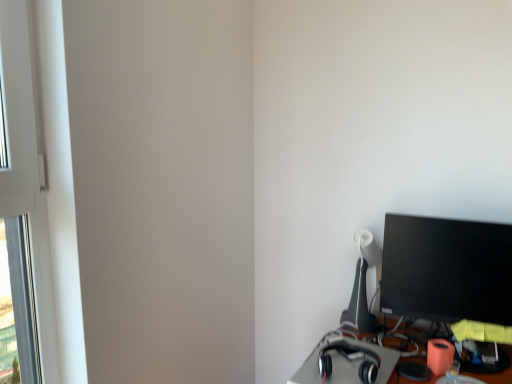
Question: From the image's perspective, is matte black table lamp at right located above satin black headphones at lower right?

Choices:
 (A) no
 (B) yes

Answer: (B)

Question: From the image's perspective, is matte black table lamp at right below satin black headphones at lower right?

Choices:
 (A) no
 (B) yes

Answer: (A)

Question: Considering the relative sizes of matte black table lamp at right and satin black headphones at lower right in the image provided, is matte black table lamp at right shorter than satin black headphones at lower right?

Choices:
 (A) no
 (B) yes

Answer: (A)

Question: Can you confirm if matte black table lamp at right is bigger than satin black headphones at lower right?

Choices:
 (A) yes
 (B) no

Answer: (A)

Question: Considering the relative positions of matte black table lamp at right and satin black headphones at lower right in the image provided, is matte black table lamp at right to the right of satin black headphones at lower right from the viewer's perspective?

Choices:
 (A) no
 (B) yes

Answer: (B)

Question: Is white plastic window frame at left wider or thinner than black glossy monitor at right?

Choices:
 (A) wide
 (B) thin

Answer: (B)

Question: Is white plastic window frame at left bigger or smaller than black glossy monitor at right?

Choices:
 (A) big
 (B) small

Answer: (A)

Question: Is white plastic window frame at left in front of or behind black glossy monitor at right in the image?

Choices:
 (A) front
 (B) behind

Answer: (A)

Question: Do you think white plastic window frame at left is within black glossy monitor at right, or outside of it?

Choices:
 (A) outside
 (B) inside

Answer: (A)

Question: Do you think satin black headphones at lower right is within matte black table lamp at right, or outside of it?

Choices:
 (A) inside
 (B) outside

Answer: (B)

Question: Considering the positions of point (374, 349) and point (362, 231), is point (374, 349) closer or farther from the camera than point (362, 231)?

Choices:
 (A) farther
 (B) closer

Answer: (B)

Question: From their relative heights in the image, would you say satin black headphones at lower right is taller or shorter than matte black table lamp at right?

Choices:
 (A) tall
 (B) short

Answer: (B)

Question: From a real-world perspective, is satin black headphones at lower right above or below matte black table lamp at right?

Choices:
 (A) above
 (B) below

Answer: (B)

Question: Looking at the image, does white plastic window frame at left seem bigger or smaller compared to satin black headphones at lower right?

Choices:
 (A) small
 (B) big

Answer: (B)

Question: Is white plastic window frame at left to the left or to the right of satin black headphones at lower right in the image?

Choices:
 (A) right
 (B) left

Answer: (B)